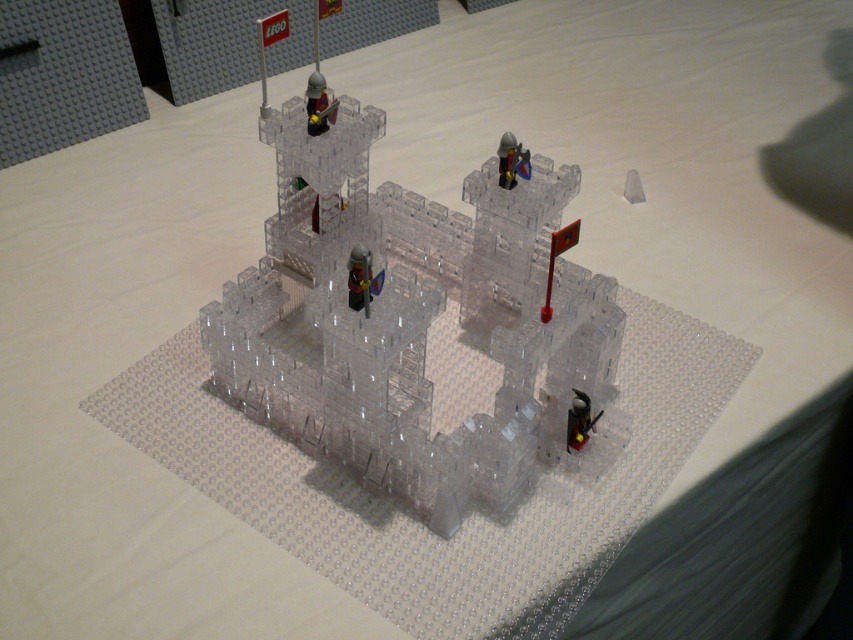
Question: From the image, what is the correct spatial relationship of transparent plastic castle at center in relation to transparent plastic figure at center?

Choices:
 (A) right
 (B) left

Answer: (A)

Question: Which object is the farthest from the transparent plastic castle at center?

Choices:
 (A) transparent plastic knight at upper center
 (B) transparent plastic figure at lower right
 (C) transparent plastic figure at center

Answer: (B)

Question: Does transparent plastic figure at center have a lesser width compared to transparent plastic figure at lower right?

Choices:
 (A) yes
 (B) no

Answer: (B)

Question: Considering the real-world distances, which object is closest to the transparent plastic castle at center?

Choices:
 (A) transparent plastic figure at center
 (B) transparent plastic figure at lower right
 (C) transparent plastic knight at upper center

Answer: (A)

Question: Which of these objects is positioned farthest from the transparent plastic figure at center?

Choices:
 (A) transparent plastic knight at upper center
 (B) transparent plastic castle at center
 (C) transparent plastic figure at lower right

Answer: (C)

Question: Can you confirm if transparent plastic castle at center is positioned above transparent plastic figure at center?

Choices:
 (A) no
 (B) yes

Answer: (A)